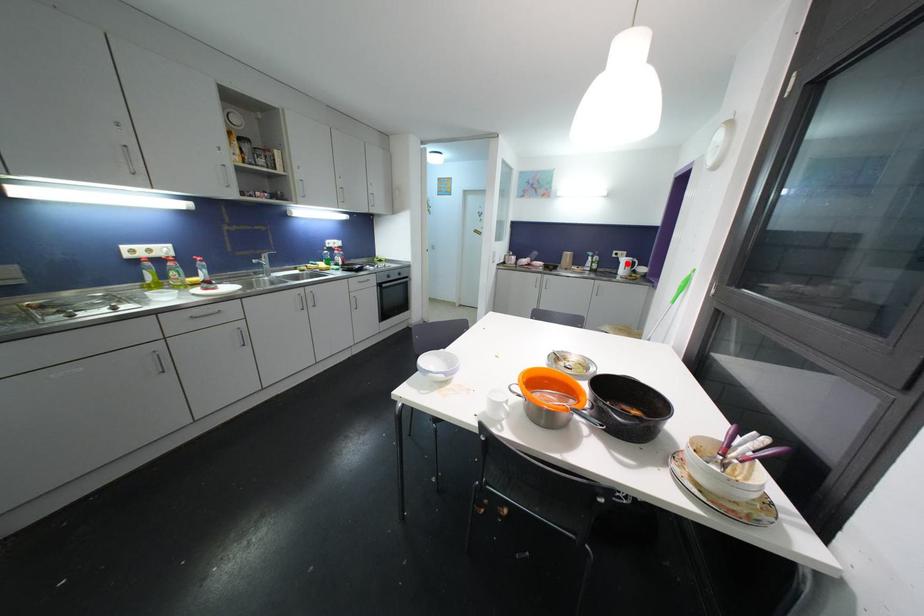
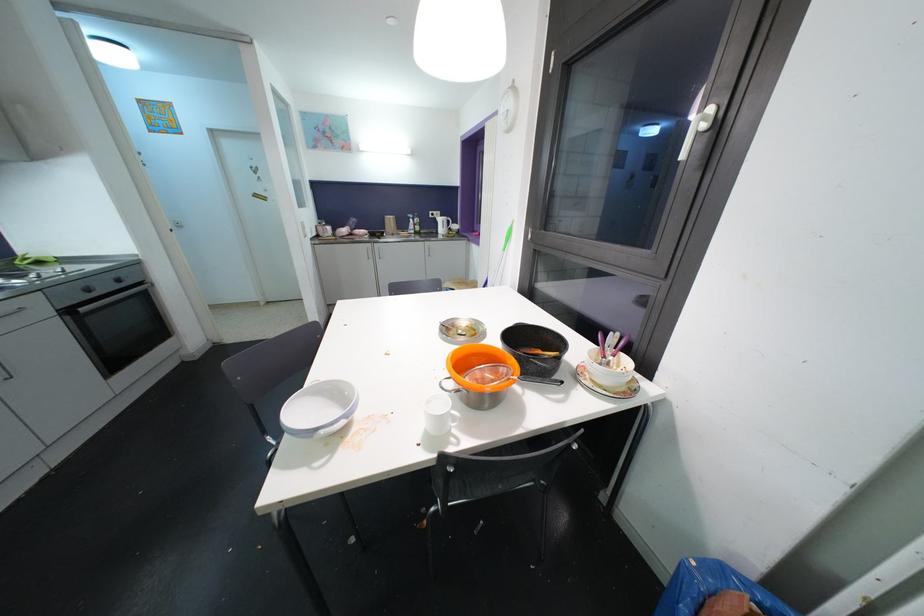
The point at the highlighted location is marked in the first image. Where is the corresponding point in the second image?

(444, 223)